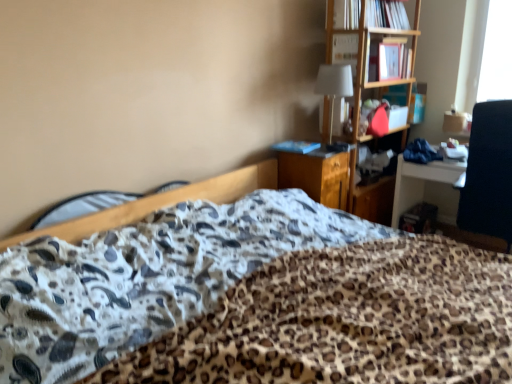
Question: Which direction should I rotate to look at blue matte book at center, which is counted as the 3th book, starting from the right?

Choices:
 (A) right
 (B) left

Answer: (A)

Question: Is wooden file cabinet at center oriented away from matte pink book at upper right, which is counted as the 2th book, starting from the top?

Choices:
 (A) yes
 (B) no

Answer: (B)

Question: From a real-world perspective, is wooden file cabinet at center located beneath matte pink book at upper right, the 3th book in the left-to-right sequence?

Choices:
 (A) yes
 (B) no

Answer: (A)

Question: Considering the relative sizes of wooden file cabinet at center and matte pink book at upper right, the 1th book when ordered from right to left, in the image provided, is wooden file cabinet at center wider than matte pink book at upper right, the 1th book when ordered from right to left,?

Choices:
 (A) yes
 (B) no

Answer: (A)

Question: Is wooden file cabinet at center oriented towards matte pink book at upper right, which is counted as the 2th book, starting from the top?

Choices:
 (A) no
 (B) yes

Answer: (A)

Question: Does wooden file cabinet at center have a lesser width compared to matte pink book at upper right, the 3th book in the left-to-right sequence?

Choices:
 (A) yes
 (B) no

Answer: (B)

Question: From a real-world perspective, is wooden file cabinet at center positioned over matte pink book at upper right, which is counted as the 2th book, starting from the top, based on gravity?

Choices:
 (A) no
 (B) yes

Answer: (A)

Question: Is matte pink book at upper right, which is counted as the 2th book, starting from the top, smaller than wooden bed frame at center?

Choices:
 (A) no
 (B) yes

Answer: (B)

Question: Could you tell me if matte pink book at upper right, arranged as the 2th book when ordered from the bottom, is turned towards wooden bed frame at center?

Choices:
 (A) no
 (B) yes

Answer: (A)

Question: Is wooden bed frame at center located within matte pink book at upper right, the 1th book when ordered from right to left?

Choices:
 (A) no
 (B) yes

Answer: (A)

Question: Is matte pink book at upper right, arranged as the 2th book when ordered from the bottom, looking in the opposite direction of wooden bed frame at center?

Choices:
 (A) no
 (B) yes

Answer: (A)

Question: Does matte pink book at upper right, the 3th book in the left-to-right sequence, have a lesser width compared to wooden bed frame at center?

Choices:
 (A) yes
 (B) no

Answer: (A)

Question: Can you confirm if matte pink book at upper right, arranged as the 2th book when ordered from the bottom, is shorter than wooden bed frame at center?

Choices:
 (A) yes
 (B) no

Answer: (A)

Question: Is blue matte book at center, positioned as the first book in left-to-right order, at the left side of white fabric lampshade at upper center?

Choices:
 (A) no
 (B) yes

Answer: (B)